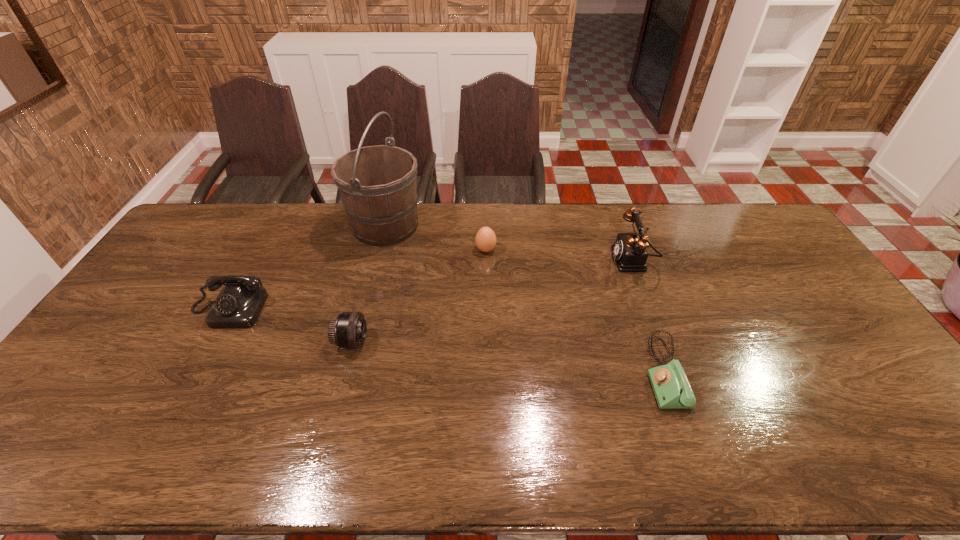
This screenshot has height=540, width=960. Identify the location of telephone present at the far edge. (629, 250).

Where is `boiled egg that is at the far edge`? The height and width of the screenshot is (540, 960). boiled egg that is at the far edge is located at coordinates (485, 240).

In the image, there is a desktop. Identify the location of free region at the far edge. This screenshot has width=960, height=540. (721, 235).

Where is `vacant space at the near edge of the desktop`? vacant space at the near edge of the desktop is located at coordinates (394, 444).

The width and height of the screenshot is (960, 540). In the image, there is a desktop. In order to click on free region at the left edge in this screenshot , I will do `click(122, 312)`.

You are a GUI agent. You are given a task and a screenshot of the screen. Output one action in this format:
    pyautogui.click(x=<x>, y=<y>)
    Task: Click on the vacant space at the right edge of the desktop
    Image resolution: width=960 pixels, height=540 pixels.
    Given the screenshot: What is the action you would take?
    pyautogui.click(x=822, y=305)

Find the location of a particular element. The height and width of the screenshot is (540, 960). blank space at the near left corner of the desktop is located at coordinates (43, 453).

Locate an element on the screen. free space between the shortest telephone and the tallest object is located at coordinates (525, 299).

Find the location of `free space between the telephoto lens and the bucket`. free space between the telephoto lens and the bucket is located at coordinates (369, 284).

Where is `vacant area between the shortest object and the second shortest telephone`? Image resolution: width=960 pixels, height=540 pixels. vacant area between the shortest object and the second shortest telephone is located at coordinates (446, 341).